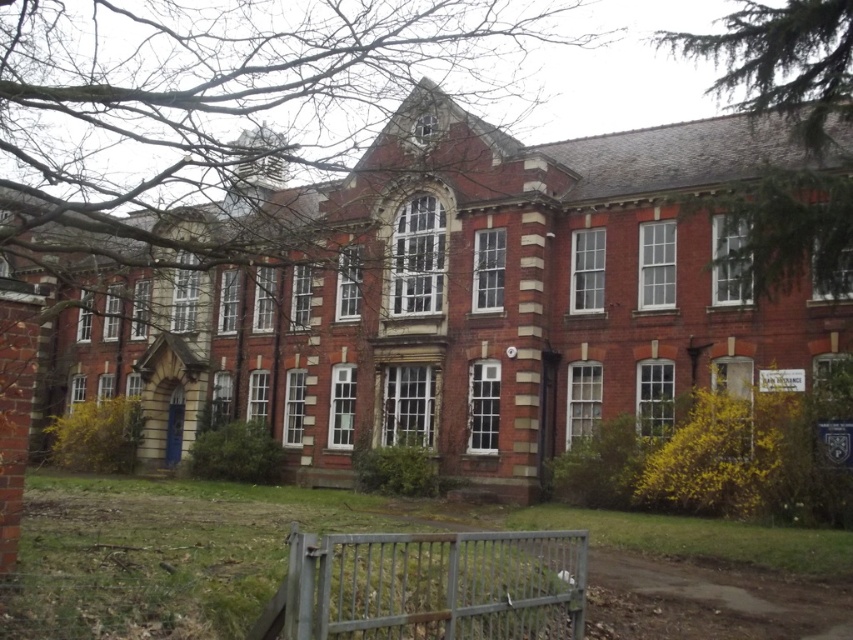
Question: Which of the following is the farthest from the observer?

Choices:
 (A) bare branches at upper center
 (B) green textured tree at upper right
 (C) metallic gate at lower center

Answer: (B)

Question: Can you confirm if bare branches at upper center is positioned to the left of green textured tree at upper right?

Choices:
 (A) no
 (B) yes

Answer: (B)

Question: Is bare branches at upper center to the right of green textured tree at upper right from the viewer's perspective?

Choices:
 (A) yes
 (B) no

Answer: (B)

Question: Does metallic gate at lower center have a larger size compared to green textured tree at upper right?

Choices:
 (A) yes
 (B) no

Answer: (B)

Question: Estimate the real-world distances between objects in this image. Which object is closer to the metallic gate at lower center?

Choices:
 (A) green textured tree at upper right
 (B) bare branches at upper center

Answer: (A)

Question: Which is farther from the green textured tree at upper right?

Choices:
 (A) metallic gate at lower center
 (B) bare branches at upper center

Answer: (B)